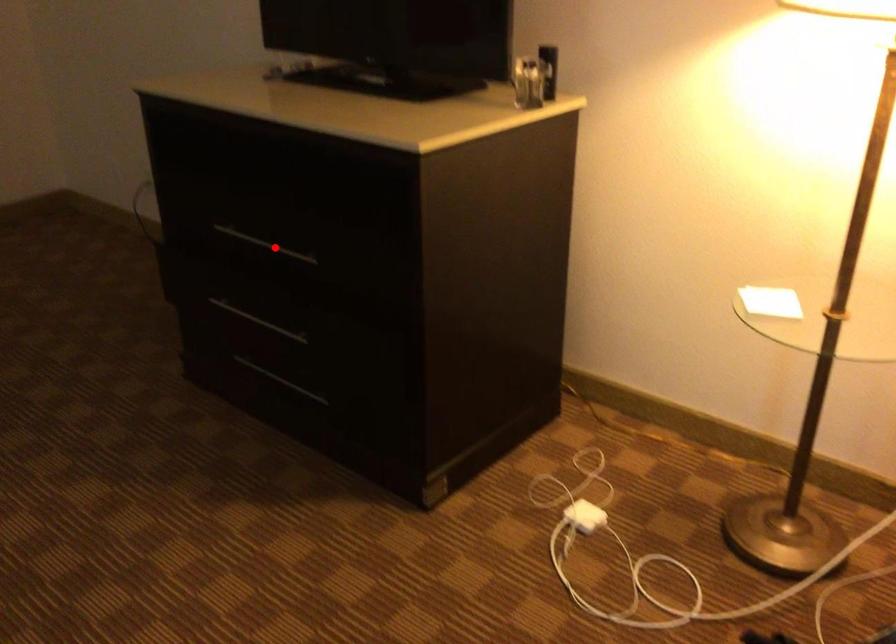
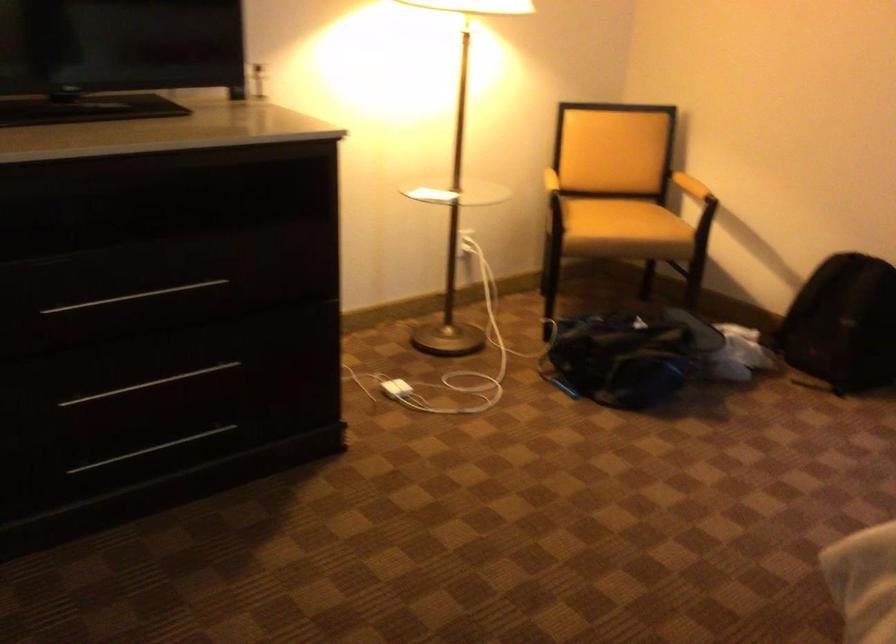
Question: A red point is marked in image1. In image2, is the corresponding 3D point closer to the camera or farther? Reply with the corresponding letter.

Choices:
 (A) The corresponding 3D point is closer.
 (B) The corresponding 3D point is farther.

Answer: (A)